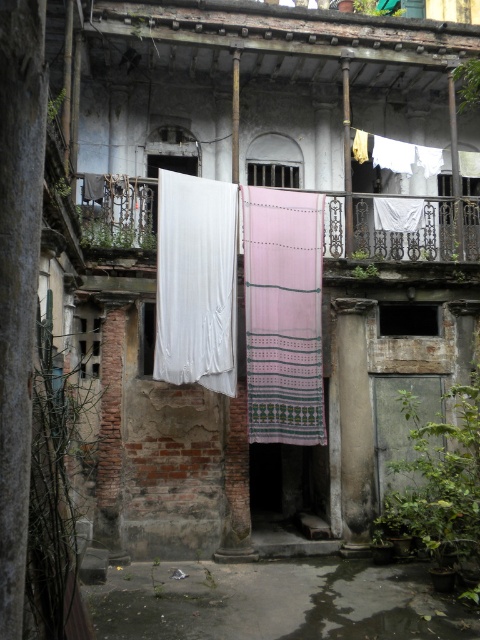
You are a window cleaner standing in the courtyard. You need to clean the white fabric curtain at left and the white fabric at upper center. Which one should you clean first if you want to start with the taller one?

The white fabric curtain at left is taller than the white fabric at upper center, so you should clean the white fabric curtain at left first.

You are standing in the courtyard of the old building and want to hang a new white fabric curtain at left. According to the coordinates provided, where exactly should you place it?

The white fabric curtain at left should be placed at the coordinates point (195, 282).